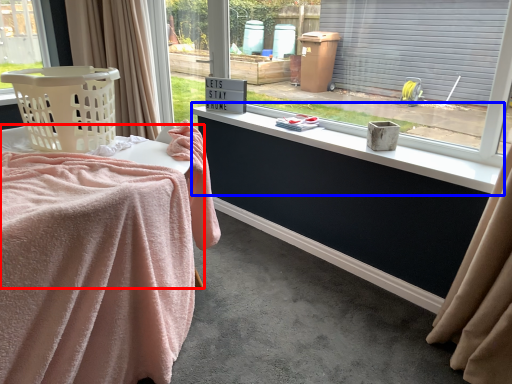
Question: Which of the following is the farthest to the observer, table (highlighted by a red box) or window sill (highlighted by a blue box)?

Choices:
 (A) table
 (B) window sill

Answer: (B)